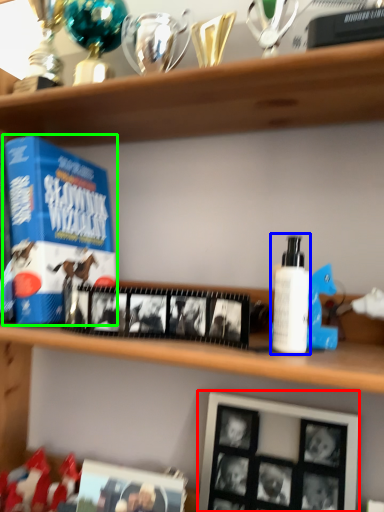
Question: Estimate the real-world distances between objects in this image. Which object is farther from picture frame (highlighted by a red box), toiletry (highlighted by a blue box) or product (highlighted by a green box)?

Choices:
 (A) toiletry
 (B) product

Answer: (B)